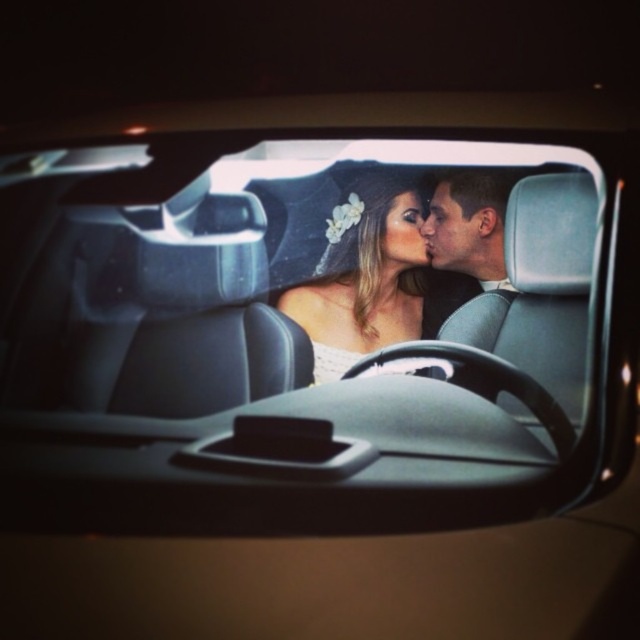
You are a photographer trying to capture the perfect shot of the white satin dress at center from the side mirror reflection. Based on the coordinates provided, where should you position your camera to ensure the dress is centered in the frame?

The white satin dress at center is located at coordinates (x=364, y=276), so positioning the camera directly facing those coordinates will center the dress in the frame.

You are a photographer trying to capture the couple in the car through the side mirror. You notice the white satin dress at center and the matte black hair at center. Which object appears taller in the reflection?

The white satin dress at center appears taller than the matte black hair at center in the reflection.

You are a photographer taking a photo of the couple in the car through the side mirror. The camera has a focus range of 5 inches. Can you focus on both the white satin dress at center and the matte black hair at center at the same time?

The white satin dress at center and the matte black hair at center are 5.77 inches apart from each other. Since the camera can only focus within a 5 inches range, the distance between them exceeds the focus range. Therefore, you cannot focus on both simultaneously.